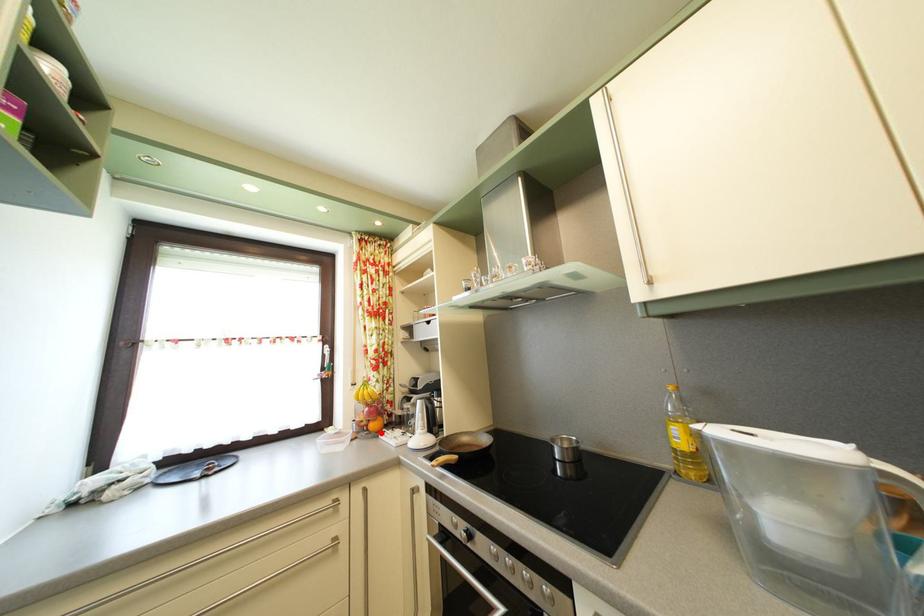
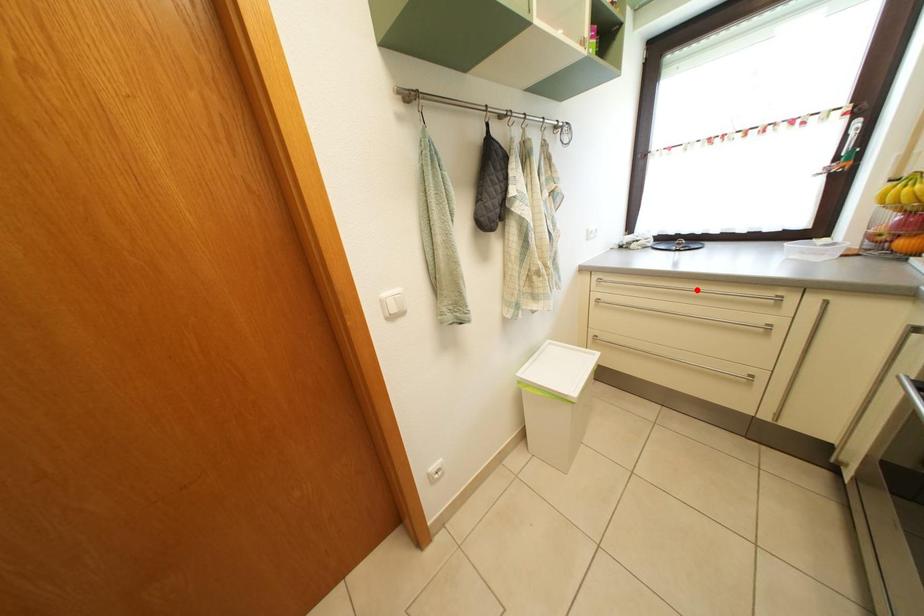
I am providing you with two images of the same scene from different viewpoints. A red point is marked on the first image and another point is marked on the second image. Do the highlighted points in image1 and image2 indicate the same real-world spot?

No